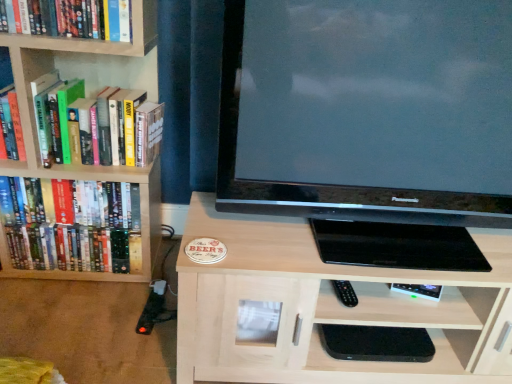
Question: From a real-world perspective, is matte black television at center positioned above or below hardcover books at left, positioned as the first book in bottom-to-top order?

Choices:
 (A) below
 (B) above

Answer: (B)

Question: From the image's perspective, is matte black television at center located above or below hardcover books at left, positioned as the first book in bottom-to-top order?

Choices:
 (A) below
 (B) above

Answer: (B)

Question: Which is nearer to the hardcover books at left, positioned as the first book in bottom-to-top order?

Choices:
 (A) hardcover books at left, which is counted as the second book, starting from the bottom
 (B) wooden bookshelf at left
 (C) hardcover book at upper left, positioned as the first book in top-to-bottom order
 (D) light wood cabinet at center
 (E) matte black television at center

Answer: (B)

Question: Which object is the farthest from the hardcover books at left, positioned as the first book in bottom-to-top order?

Choices:
 (A) matte black television at center
 (B) hardcover book at upper left, placed as the 3th book when sorted from bottom to top
 (C) light wood cabinet at center
 (D) wooden bookshelf at left
 (E) hardcover books at left, which ranks as the 2th book in top-to-bottom order

Answer: (A)